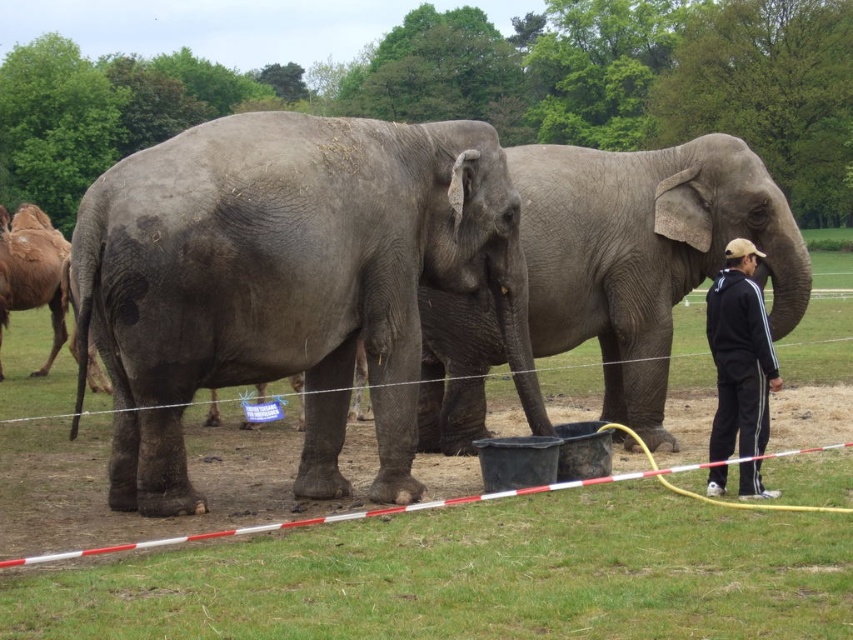
You are a zookeeper who needs to separate the two elephants for feeding. If you walk towards the gray textured elephant at center and the gray matte elephant at center, which one should you approach first to ensure you can reach them without crossing paths?

You should approach the gray textured elephant at center first because it is to the left of the gray matte elephant at center, so you can reach it without crossing paths.

You are a zookeeper observing the two elephants in the enclosure. You notice that the gray textured elephant at center and the gray matte elephant at center are positioned in a specific way. Which elephant is standing closer to the front of the enclosure?

The gray textured elephant at center is located below the gray matte elephant at center, meaning it is positioned closer to the front of the enclosure.